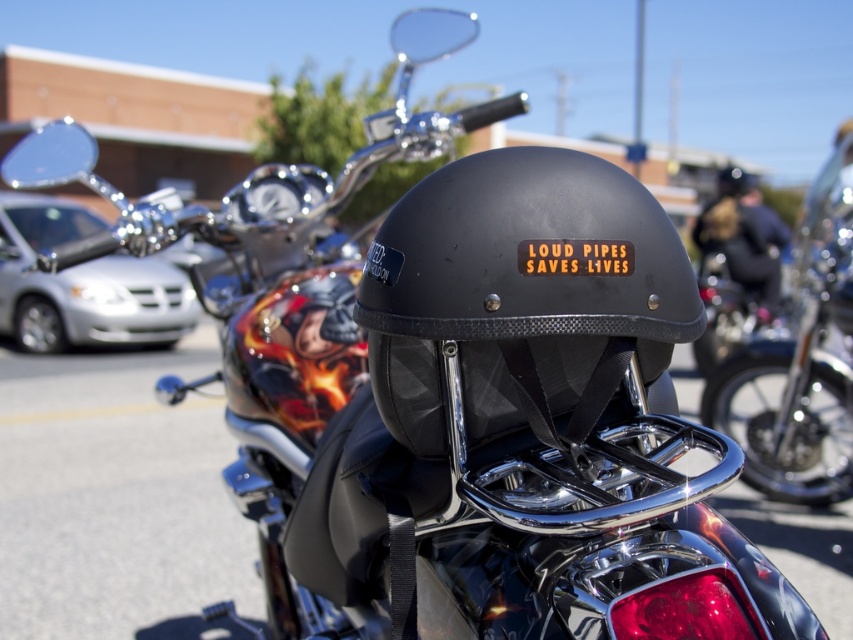
Question: Which point is closer to the camera taking this photo?

Choices:
 (A) (845, 486)
 (B) (756, 240)
 (C) (422, 257)

Answer: (C)

Question: Estimate the real-world distances between objects in this image. Which object is closer to the matte black helmet at center?

Choices:
 (A) shiny chrome motorcycle at center
 (B) matte black helmet at upper center

Answer: (A)

Question: Is shiny chrome motorcycle at center above matte black helmet at upper center?

Choices:
 (A) no
 (B) yes

Answer: (A)

Question: Considering the relative positions of shiny chrome motorcycle at center and matte black helmet at upper center in the image provided, where is shiny chrome motorcycle at center located with respect to matte black helmet at upper center?

Choices:
 (A) above
 (B) below

Answer: (B)

Question: Among these points, which one is nearest to the camera?

Choices:
 (A) (749, 225)
 (B) (637, 248)
 (C) (724, 420)

Answer: (B)

Question: Is the position of matte black helmet at center more distant than that of matte black helmet at upper center?

Choices:
 (A) yes
 (B) no

Answer: (B)